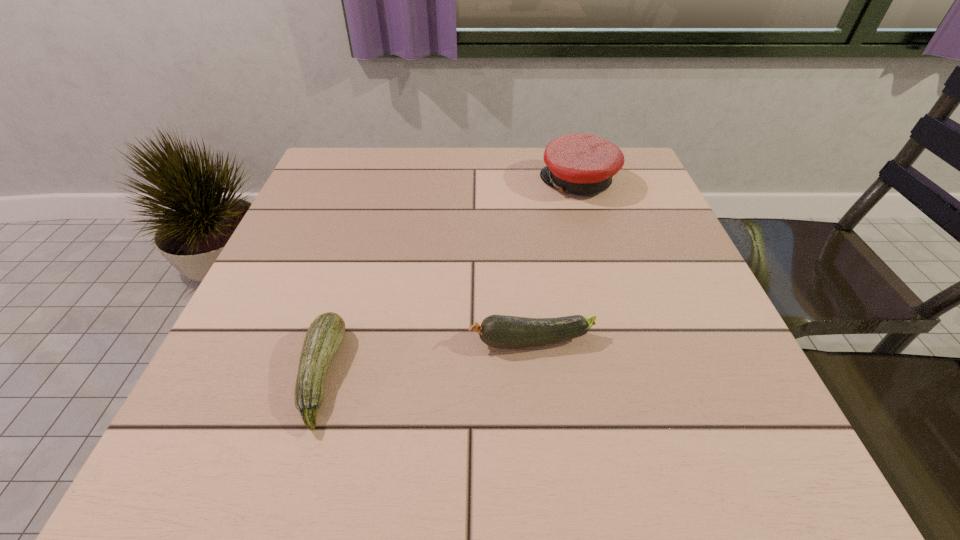
I want to click on vacant space located at the blossom end of the right zucchini, so click(256, 341).

Locate an element on the screen. Image resolution: width=960 pixels, height=540 pixels. object that is at the far edge is located at coordinates (581, 164).

The width and height of the screenshot is (960, 540). I want to click on object at the near edge, so click(325, 334).

Identify the location of object located at the left edge. (325, 334).

At what (x,y) coordinates should I click in order to perform the action: click on object that is at the right edge. Please return your answer as a coordinate pair (x, y). Looking at the image, I should click on (581, 164).

In order to click on object at the near left corner in this screenshot , I will do `click(325, 334)`.

The image size is (960, 540). In order to click on object that is at the far right corner in this screenshot , I will do `click(581, 164)`.

Locate an element on the screen. vacant space at the far edge is located at coordinates point(436,151).

Find the location of `vacant space at the near edge of the desktop`. vacant space at the near edge of the desktop is located at coordinates (463, 453).

I want to click on vacant area at the left edge, so click(276, 342).